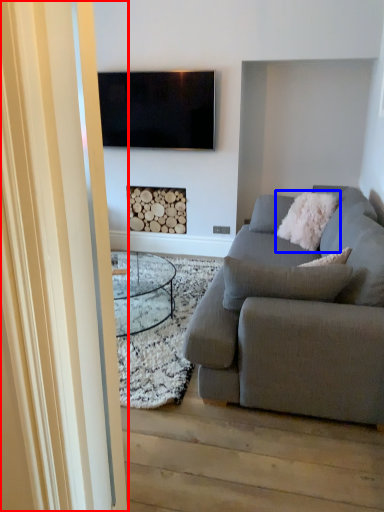
Question: Which object is closer to the camera taking this photo, glass door (highlighted by a red box) or pillow (highlighted by a blue box)?

Choices:
 (A) glass door
 (B) pillow

Answer: (A)